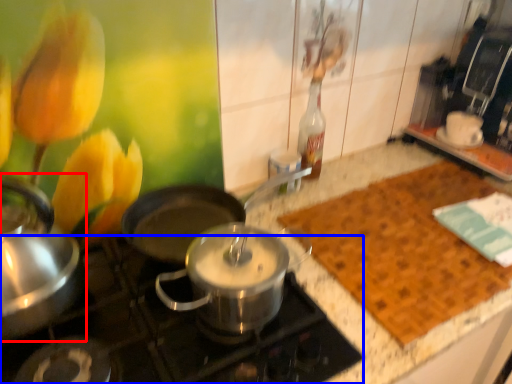
Question: Which of the following is the closest to the observer, kitchen appliance (highlighted by a red box) or gas stove (highlighted by a blue box)?

Choices:
 (A) kitchen appliance
 (B) gas stove

Answer: (B)